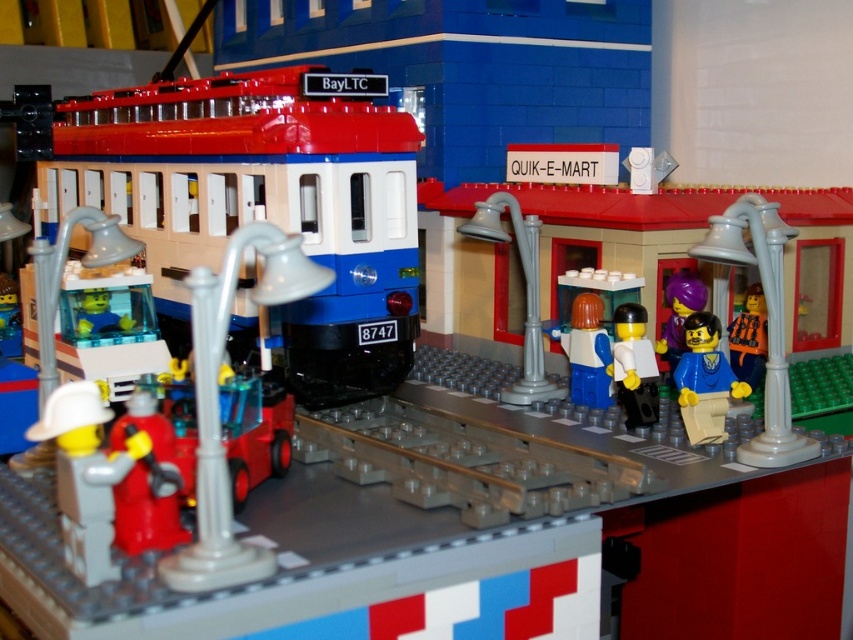
Question: Is blue matte minifigure at center-right bigger than white plastic minifigure at center-right?

Choices:
 (A) yes
 (B) no

Answer: (A)

Question: Considering the real-world distances, which object is closest to the purple matte figure at center-right?

Choices:
 (A) orange plastic figure at center right
 (B) smooth plastic train at center
 (C) white plastic minifigure at center-right

Answer: (A)

Question: Does smooth plastic train at center have a larger size compared to blue matte minifigure at center-right?

Choices:
 (A) no
 (B) yes

Answer: (B)

Question: Can you confirm if red matte firefighter at lower left is bigger than purple matte figure at center-right?

Choices:
 (A) no
 (B) yes

Answer: (B)

Question: Which point is closer to the camera?

Choices:
 (A) orange plastic figure at center right
 (B) white plastic minifigure at center-right

Answer: (B)

Question: Which point is closer to the camera?

Choices:
 (A) (297, 422)
 (B) (660, 348)
 (C) (184, 132)
 (D) (758, 348)

Answer: (A)